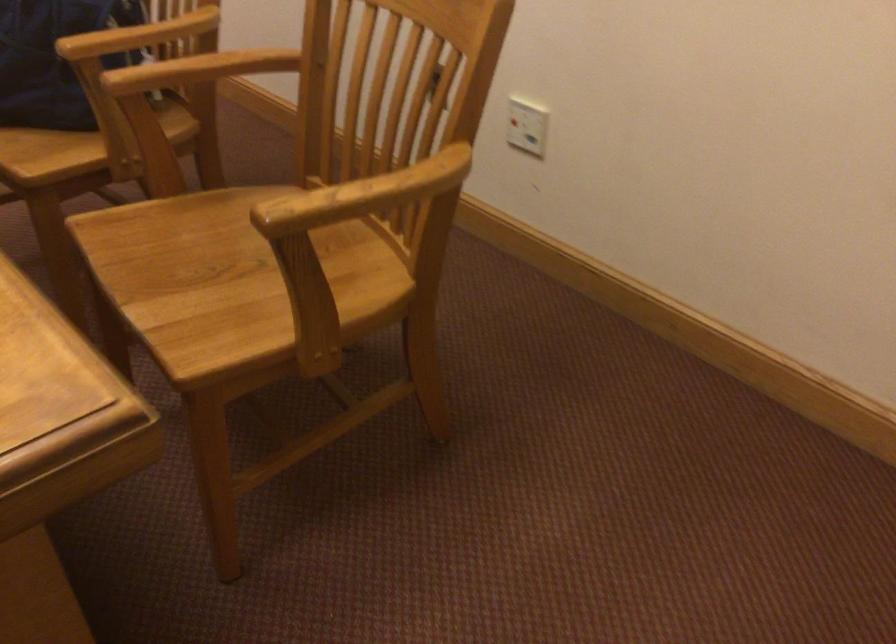
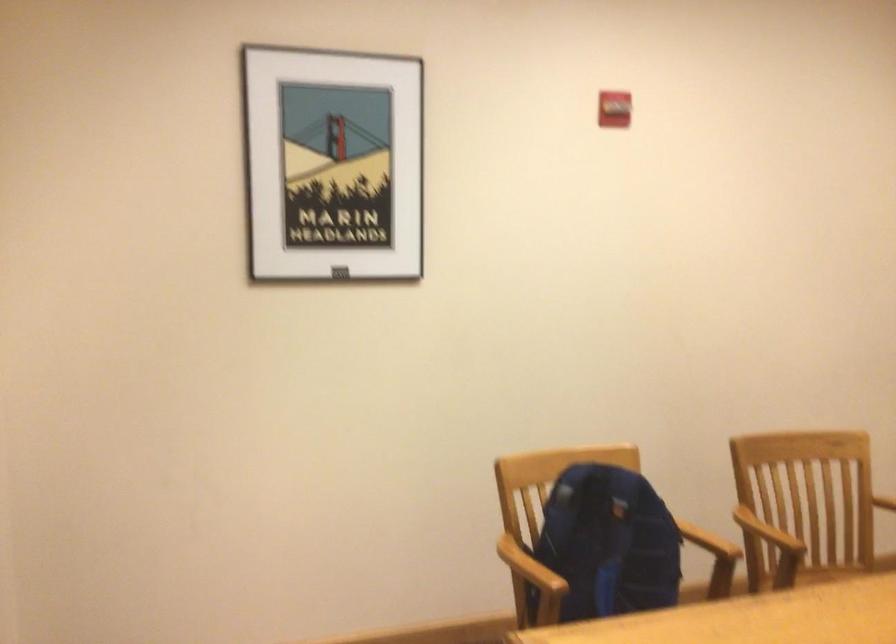
The point at (375, 222) is marked in the first image. Where is the corresponding point in the second image?

(837, 572)